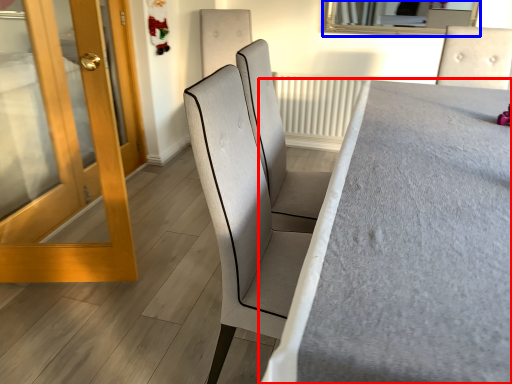
Question: Which object appears closest to the camera in this image, furniture (highlighted by a red box) or mirror (highlighted by a blue box)?

Choices:
 (A) furniture
 (B) mirror

Answer: (A)